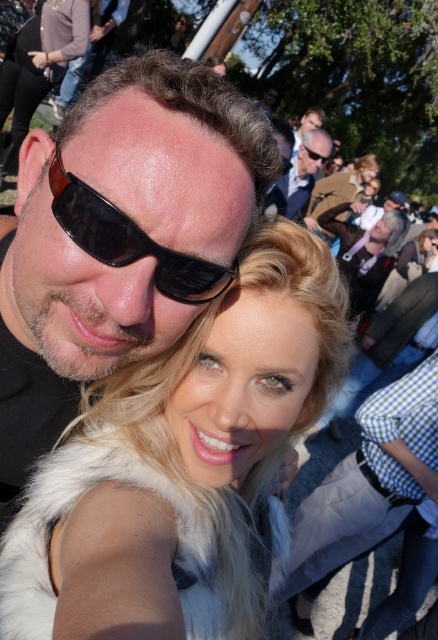
Which is above, blonde fur coat at center or blonde hair at center?

blonde hair at center

Which is behind, point (243, 506) or point (52, 84)?

The point (52, 84) is behind.

Is point (283, 388) closer to viewer compared to point (53, 36)?

Yes, it is.

The image size is (438, 640). I want to click on blonde fur coat at center, so click(x=183, y=467).

Is black matte sunglasses at center to the left of blonde hair at center from the viewer's perspective?

No, black matte sunglasses at center is not to the left of blonde hair at center.

Does black matte sunglasses at center lie behind blonde hair at center?

No, it is in front of blonde hair at center.

Which is behind, point (169, 291) or point (14, 140)?

Point (14, 140)

Locate an element on the screen. The width and height of the screenshot is (438, 640). black matte sunglasses at center is located at coordinates (129, 241).

Between blonde fur coat at center and black matte sunglasses at center, which one is positioned higher?

black matte sunglasses at center is above.

Based on the photo, can you confirm if blonde fur coat at center is taller than black matte sunglasses at center?

Yes, blonde fur coat at center is taller than black matte sunglasses at center.

This screenshot has width=438, height=640. I want to click on blonde fur coat at center, so click(x=183, y=467).